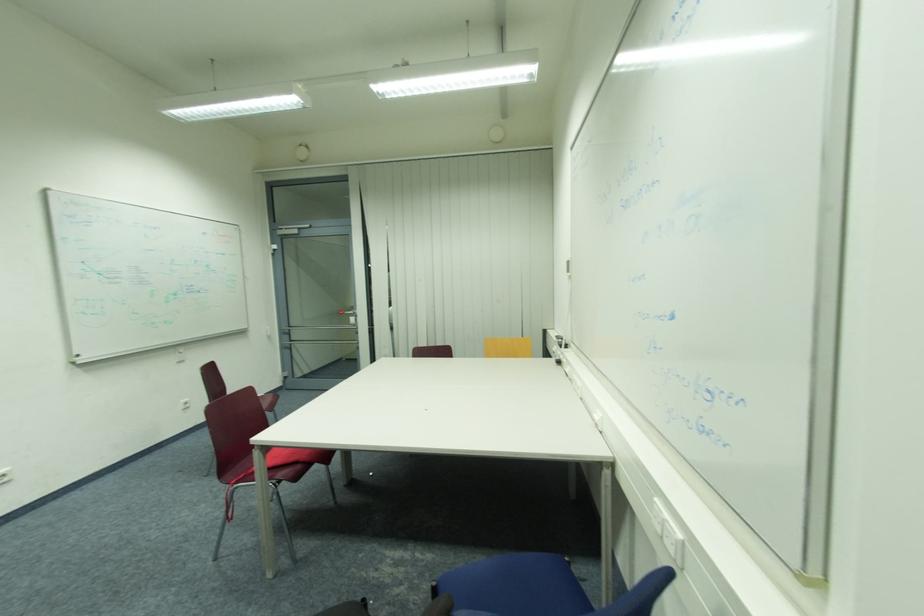
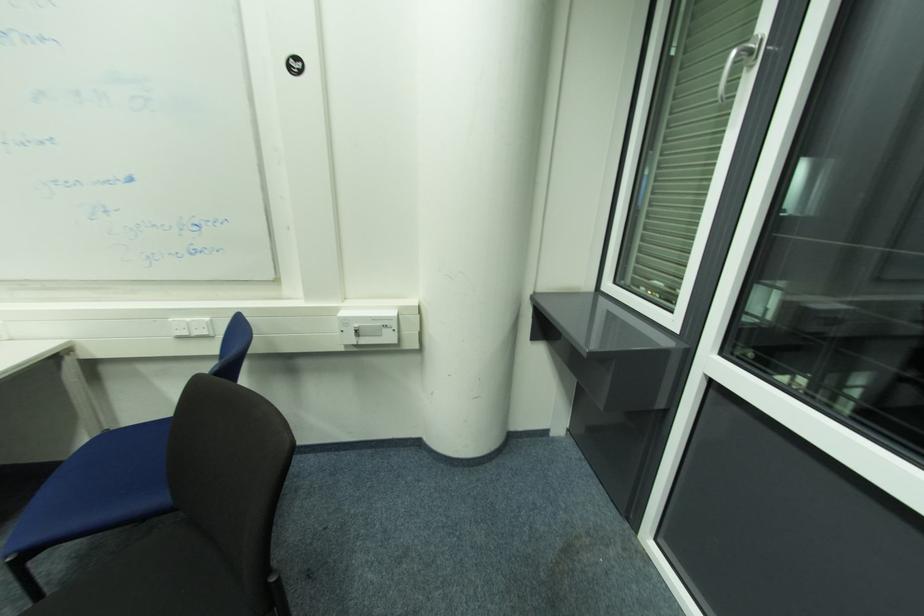
Based on the continuous images, in which direction is the camera rotating?

The camera rotated toward right-down.